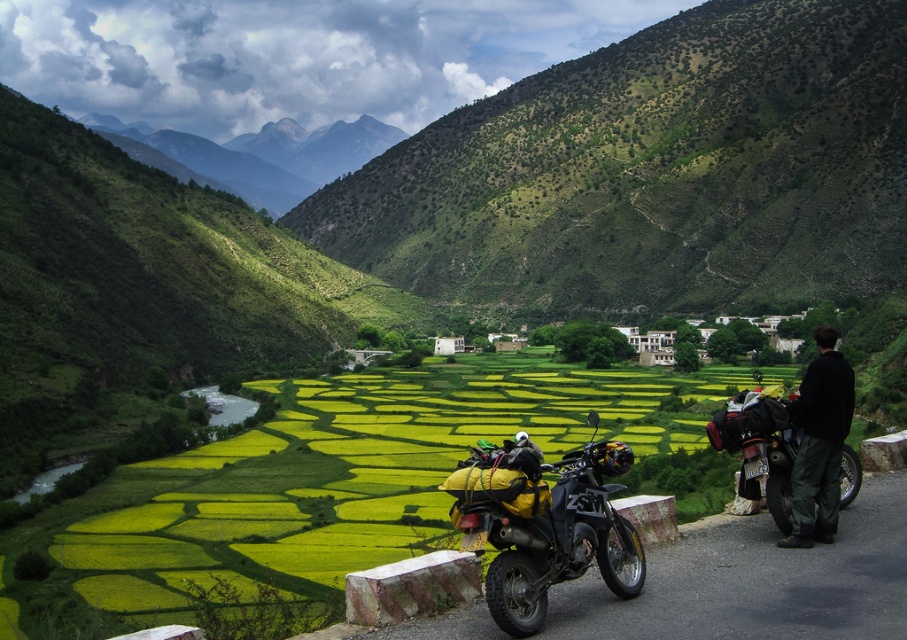
Can you confirm if green grassy hillside at center is thinner than black textured motorcycle at right?

In fact, green grassy hillside at center might be wider than black textured motorcycle at right.

Locate an element on the screen. green grassy hillside at center is located at coordinates (654, 172).

Based on the photo, does green textured rice field at center appear on the left side of matte black motorcycle at center?

Indeed, green textured rice field at center is positioned on the left side of matte black motorcycle at center.

Measure the distance between green textured rice field at center and matte black motorcycle at center.

36.47 meters

The image size is (907, 640). Describe the element at coordinates (356, 476) in the screenshot. I see `green textured rice field at center` at that location.

Identify the location of green textured rice field at center. (356, 476).

Is green textured rice field at center wider than black softshell jacket at right?

Correct, the width of green textured rice field at center exceeds that of black softshell jacket at right.

Who is more distant from viewer, (155,595) or (830,410)?

Positioned behind is point (155,595).

Between point (171, 477) and point (797, 419), which one is positioned behind?

The point (171, 477) is more distant.

Locate an element on the screen. Image resolution: width=907 pixels, height=640 pixels. green textured rice field at center is located at coordinates (356, 476).